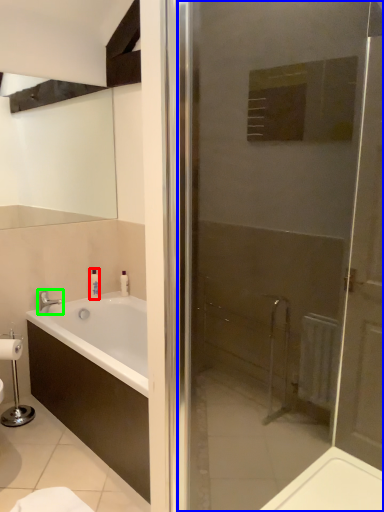
Question: Which is nearer to the toiletry (highlighted by a red box)? door (highlighted by a blue box) or tap (highlighted by a green box).

Choices:
 (A) door
 (B) tap

Answer: (B)